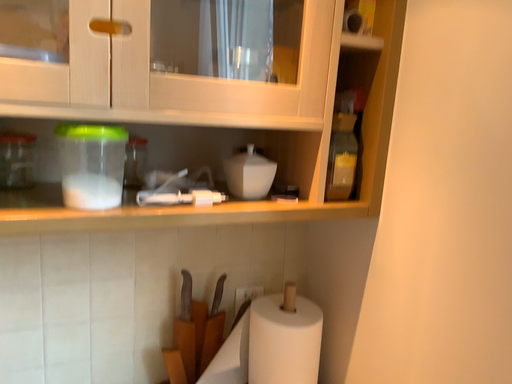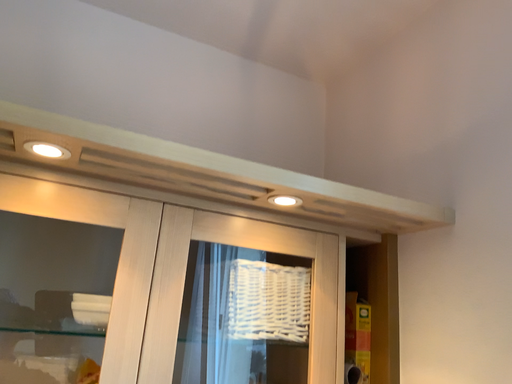
Question: Which way did the camera rotate in the video?

Choices:
 (A) rotated downward
 (B) rotated upward

Answer: (B)